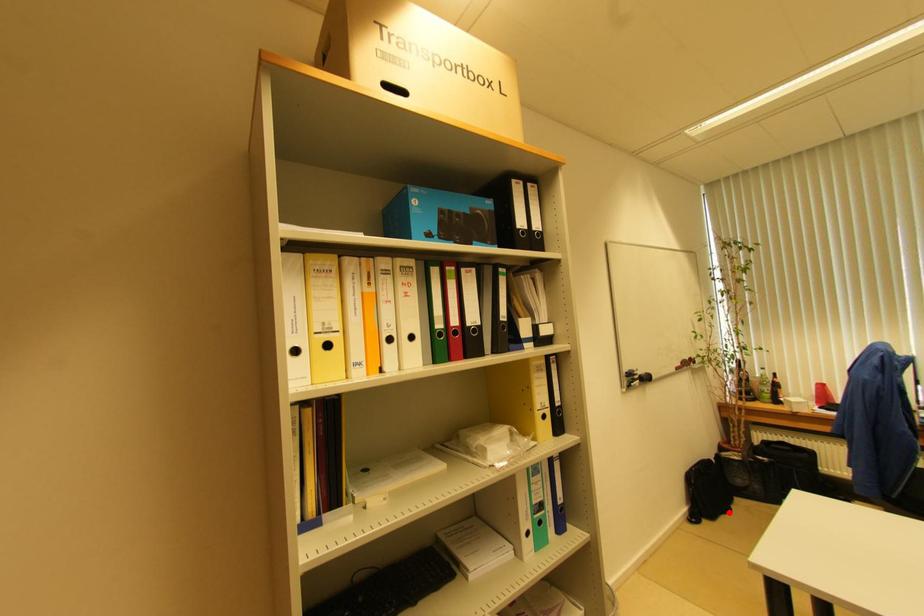
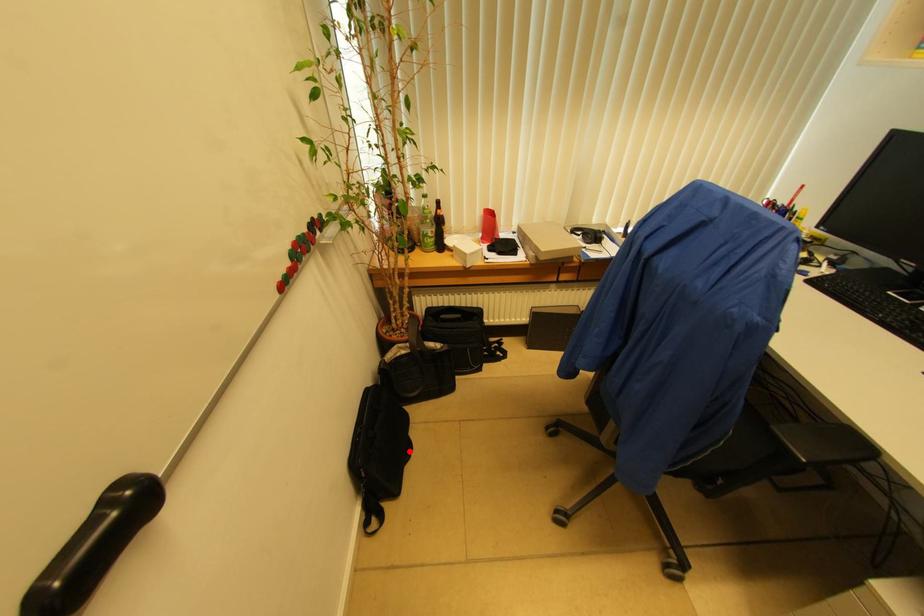
I am providing you with two images of the same scene from different viewpoints. A red point is marked on the first image and another point is marked on the second image. Are the points marked in image1 and image2 representing the same 3D position?

Yes